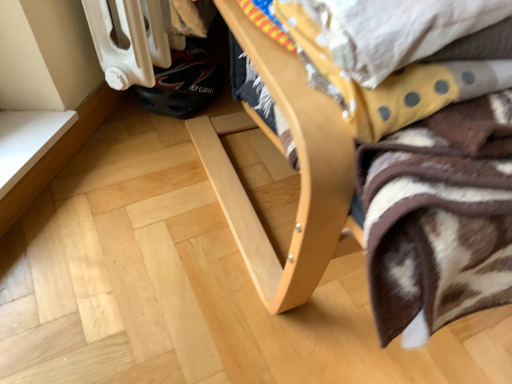
What do you see at coordinates (365, 88) in the screenshot? I see `yellow dotted fabric at upper right` at bounding box center [365, 88].

This screenshot has height=384, width=512. Identify the location of yellow dotted fabric at upper right. (365, 88).

This screenshot has width=512, height=384. Describe the element at coordinates (282, 153) in the screenshot. I see `natural wood bed frame at center` at that location.

This screenshot has height=384, width=512. I want to click on natural wood bed frame at center, so click(282, 153).

What is the approximate height of natural wood bed frame at center?

natural wood bed frame at center is 25.48 inches in height.

I want to click on yellow dotted fabric at upper right, so click(x=365, y=88).

Can you confirm if natural wood bed frame at center is positioned to the left of yellow dotted fabric at upper right?

Incorrect, natural wood bed frame at center is not on the left side of yellow dotted fabric at upper right.

Considering the relative positions of natural wood bed frame at center and yellow dotted fabric at upper right in the image provided, is natural wood bed frame at center in front of yellow dotted fabric at upper right?

Yes, natural wood bed frame at center is closer to the camera.

Which is farther, (x=280, y=91) or (x=304, y=14)?

Positioned behind is point (x=304, y=14).

From the image's perspective, which is below, natural wood bed frame at center or yellow dotted fabric at upper right?

yellow dotted fabric at upper right is shown below in the image.

From a real-world perspective, is natural wood bed frame at center below yellow dotted fabric at upper right?

Yes.

Looking at their sizes, would you say natural wood bed frame at center is wider or thinner than yellow dotted fabric at upper right?

Considering their sizes, natural wood bed frame at center looks broader than yellow dotted fabric at upper right.

Who is shorter, natural wood bed frame at center or yellow dotted fabric at upper right?

Standing shorter between the two is yellow dotted fabric at upper right.

From the picture: Which of these two, natural wood bed frame at center or yellow dotted fabric at upper right, is smaller?

Smaller between the two is yellow dotted fabric at upper right.

Is natural wood bed frame at center spatially inside yellow dotted fabric at upper right, or outside of it?

natural wood bed frame at center is not inside yellow dotted fabric at upper right, it's outside.

Looking at this image, is natural wood bed frame at center next to yellow dotted fabric at upper right?

No, natural wood bed frame at center is not with yellow dotted fabric at upper right.

Is natural wood bed frame at center positioned with its back to yellow dotted fabric at upper right?

No, natural wood bed frame at center's orientation is not away from yellow dotted fabric at upper right.

Locate an element on the screen. The height and width of the screenshot is (384, 512). blanket above the natural wood bed frame at center (from a real-world perspective) is located at coordinates (365, 88).

Visually, is yellow dotted fabric at upper right positioned to the left or to the right of natural wood bed frame at center?

yellow dotted fabric at upper right is to the left of natural wood bed frame at center.

Relative to natural wood bed frame at center, is yellow dotted fabric at upper right in front or behind?

Clearly, yellow dotted fabric at upper right is behind natural wood bed frame at center.

Considering the points (357, 94) and (237, 25), which point is in front, point (357, 94) or point (237, 25)?

The point (357, 94) is closer to the camera.

Consider the image. From the image's perspective, who appears lower, yellow dotted fabric at upper right or natural wood bed frame at center?

yellow dotted fabric at upper right.

From a real-world perspective, relative to natural wood bed frame at center, is yellow dotted fabric at upper right vertically above or below?

From a real-world perspective, yellow dotted fabric at upper right is physically above natural wood bed frame at center.

Is yellow dotted fabric at upper right wider or thinner than natural wood bed frame at center?

In the image, yellow dotted fabric at upper right appears to be more narrow than natural wood bed frame at center.

Does yellow dotted fabric at upper right have a greater height compared to natural wood bed frame at center?

No, yellow dotted fabric at upper right is not taller than natural wood bed frame at center.

Does yellow dotted fabric at upper right have a larger size compared to natural wood bed frame at center?

No, yellow dotted fabric at upper right is not bigger than natural wood bed frame at center.

Is natural wood bed frame at center a part of yellow dotted fabric at upper right?

No, natural wood bed frame at center is located outside of yellow dotted fabric at upper right.

In the scene shown: Is there a large distance between yellow dotted fabric at upper right and natural wood bed frame at center?

They are positioned close to each other.

Consider the image. Is yellow dotted fabric at upper right aimed at natural wood bed frame at center?

Yes, yellow dotted fabric at upper right is oriented towards natural wood bed frame at center.

The height and width of the screenshot is (384, 512). In order to click on furniture that is under the yellow dotted fabric at upper right (from a real-world perspective) in this screenshot , I will do `click(282, 153)`.

You are a GUI agent. You are given a task and a screenshot of the screen. Output one action in this format:
    pyautogui.click(x=<x>, y=<y>)
    Task: Click on the furniture on the right side of yellow dotted fabric at upper right
    The height and width of the screenshot is (384, 512).
    Given the screenshot: What is the action you would take?
    pyautogui.click(x=282, y=153)

Locate an element on the screen. blanket lying behind the natural wood bed frame at center is located at coordinates [x=365, y=88].